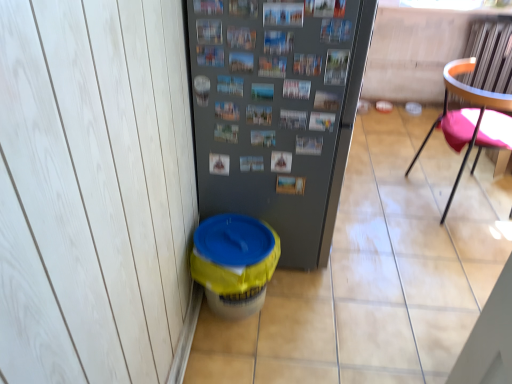
Question: Does yellow plastic potty at lower left have a lesser width compared to metallic gray refrigerator at center?

Choices:
 (A) yes
 (B) no

Answer: (A)

Question: Is yellow plastic potty at lower left completely or partially outside of metallic gray refrigerator at center?

Choices:
 (A) no
 (B) yes

Answer: (B)

Question: From the image's perspective, is yellow plastic potty at lower left above metallic gray refrigerator at center?

Choices:
 (A) no
 (B) yes

Answer: (A)

Question: From a real-world perspective, is yellow plastic potty at lower left beneath metallic gray refrigerator at center?

Choices:
 (A) yes
 (B) no

Answer: (A)

Question: Is the depth of yellow plastic potty at lower left greater than that of metallic gray refrigerator at center?

Choices:
 (A) no
 (B) yes

Answer: (B)

Question: Is yellow plastic potty at lower left wider or thinner than orange plastic chair at right?

Choices:
 (A) wide
 (B) thin

Answer: (B)

Question: Is yellow plastic potty at lower left taller or shorter than orange plastic chair at right?

Choices:
 (A) short
 (B) tall

Answer: (A)

Question: From the image's perspective, is yellow plastic potty at lower left located above or below orange plastic chair at right?

Choices:
 (A) above
 (B) below

Answer: (B)

Question: Considering the positions of yellow plastic potty at lower left and orange plastic chair at right in the image, is yellow plastic potty at lower left bigger or smaller than orange plastic chair at right?

Choices:
 (A) small
 (B) big

Answer: (A)

Question: Is point (271, 196) closer or farther from the camera than point (232, 258)?

Choices:
 (A) farther
 (B) closer

Answer: (A)

Question: Based on their positions, is metallic gray refrigerator at center located to the left or right of yellow plastic potty at lower left?

Choices:
 (A) right
 (B) left

Answer: (A)

Question: Considering their positions, is metallic gray refrigerator at center located in front of or behind yellow plastic potty at lower left?

Choices:
 (A) behind
 (B) front

Answer: (B)

Question: From a real-world perspective, relative to yellow plastic potty at lower left, is metallic gray refrigerator at center vertically above or below?

Choices:
 (A) above
 (B) below

Answer: (A)

Question: In the image, is orange plastic chair at right on the left side or the right side of metallic gray refrigerator at center?

Choices:
 (A) right
 (B) left

Answer: (A)

Question: Looking at their shapes, would you say orange plastic chair at right is wider or thinner than metallic gray refrigerator at center?

Choices:
 (A) wide
 (B) thin

Answer: (B)